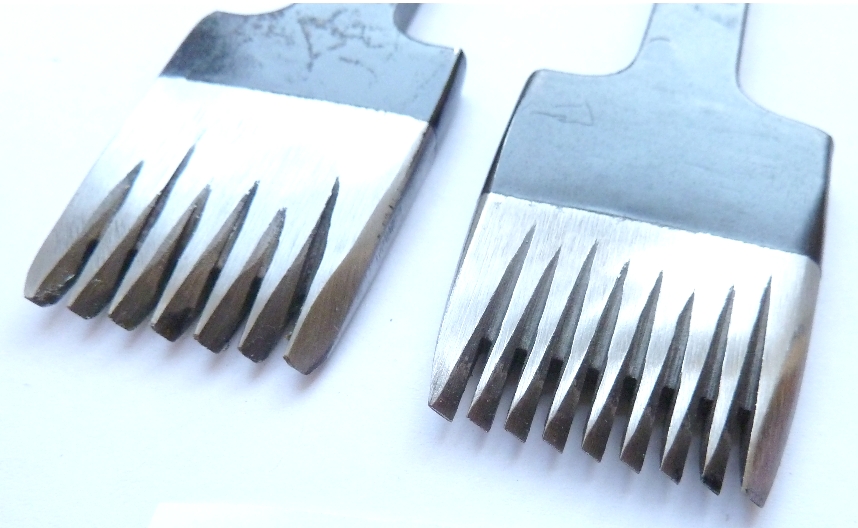
Where is `black painted handle`? black painted handle is located at coordinates (360, 56), (619, 124).